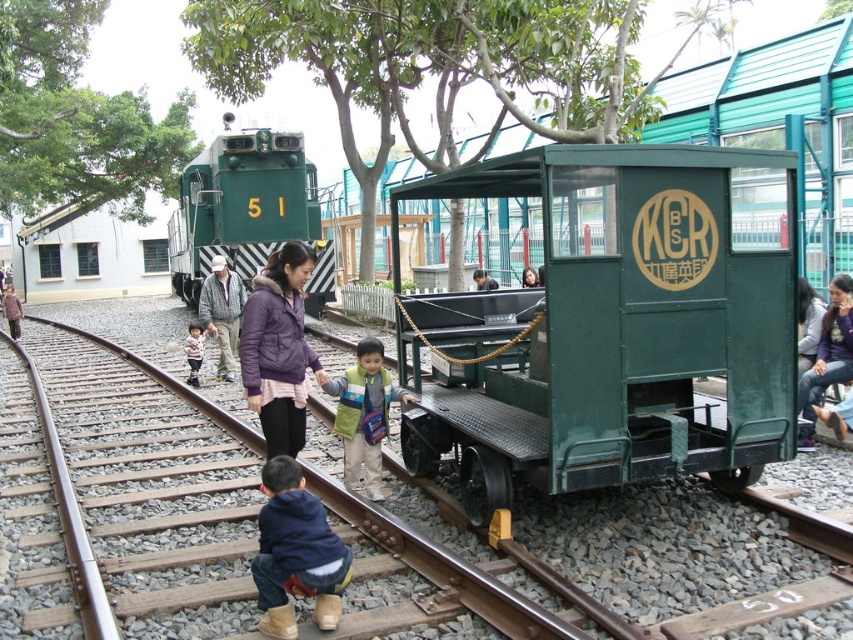
Can you confirm if green metal train track at center is smaller than blue fleece jacket at lower center?

Incorrect, green metal train track at center is not smaller in size than blue fleece jacket at lower center.

Is point (57, 554) farther from camera compared to point (265, 566)?

Yes, it is.

This screenshot has width=853, height=640. Find the location of `green metal train track at center`. green metal train track at center is located at coordinates (154, 492).

Can you confirm if light blue fabric backpack at center is thinner than light brown leather shoes at lower left?

Yes.

Who is positioned more to the left, light blue fabric backpack at center or light brown leather shoes at lower left?

Positioned to the left is light brown leather shoes at lower left.

Locate an element on the screen. The width and height of the screenshot is (853, 640). light blue fabric backpack at center is located at coordinates (364, 413).

Does green matte train at center have a lesser width compared to purple puffy jacket at center?

No, green matte train at center is not thinner than purple puffy jacket at center.

Is green matte train at center closer to camera compared to purple puffy jacket at center?

No, it is not.

Is point (170, 269) farther from camera compared to point (283, 250)?

Yes, it is.

Locate an element on the screen. green matte train at center is located at coordinates (247, 211).